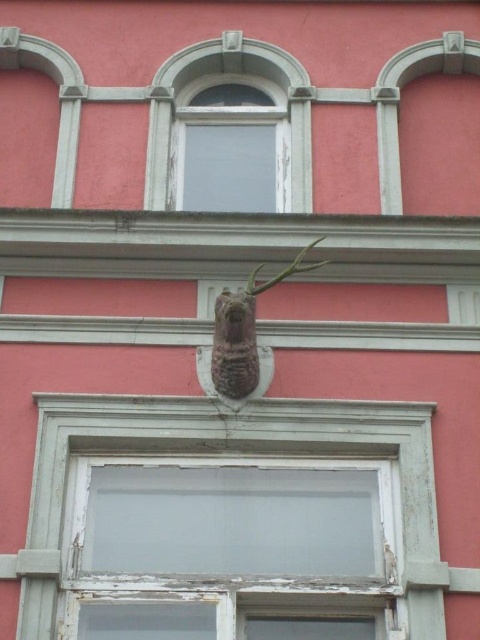
Question: Which point is closer to the camera taking this photo?

Choices:
 (A) (217, 371)
 (B) (169, 92)
 (C) (110, 420)
 (D) (291, 260)

Answer: (C)

Question: Can you confirm if weathered wood window frame at center is bigger than green wood branch at center?

Choices:
 (A) yes
 (B) no

Answer: (A)

Question: Is matte glass window at upper center smaller than green wood branch at center?

Choices:
 (A) no
 (B) yes

Answer: (A)

Question: Among these points, which one is nearest to the camera?

Choices:
 (A) (31, 528)
 (B) (251, 292)
 (C) (193, 74)
 (D) (256, 355)

Answer: (A)

Question: Considering the relative positions of rustic stone owl at center and green wood branch at center in the image provided, where is rustic stone owl at center located with respect to green wood branch at center?

Choices:
 (A) below
 (B) above

Answer: (A)

Question: Which is farther from the rustic stone owl at center?

Choices:
 (A) weathered wood window frame at center
 (B) matte glass window at upper center

Answer: (B)